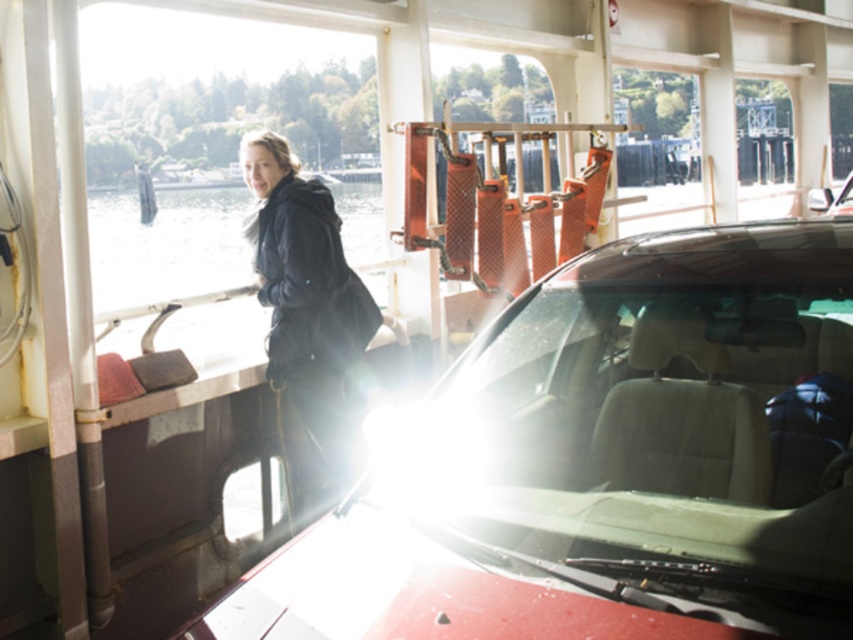
Which of these two, transparent glass windshield at center or black matte jacket at left, stands taller?

With more height is black matte jacket at left.

Does transparent glass windshield at center have a greater height compared to black matte jacket at left?

No, transparent glass windshield at center is not taller than black matte jacket at left.

Image resolution: width=853 pixels, height=640 pixels. Find the location of `transparent glass windshield at center`. transparent glass windshield at center is located at coordinates (608, 461).